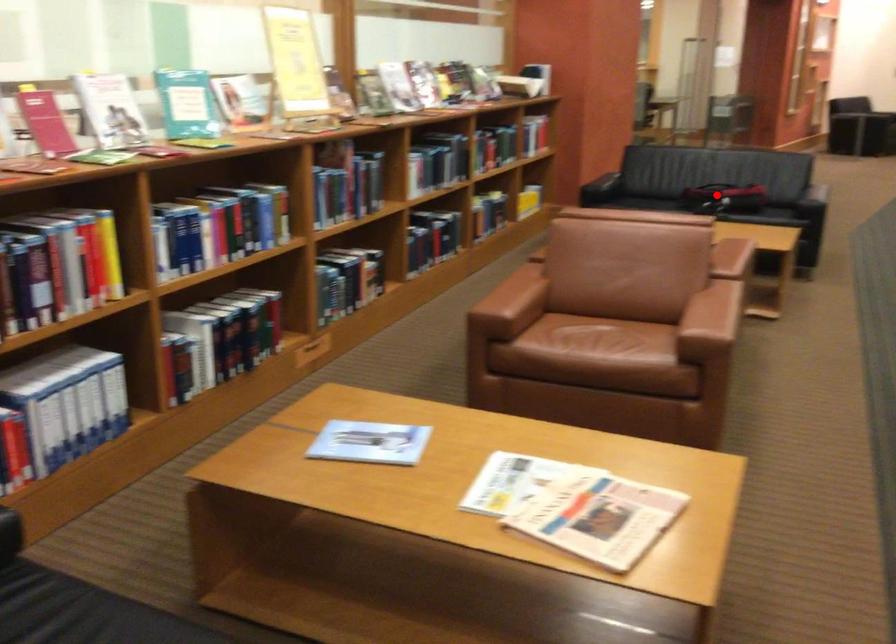
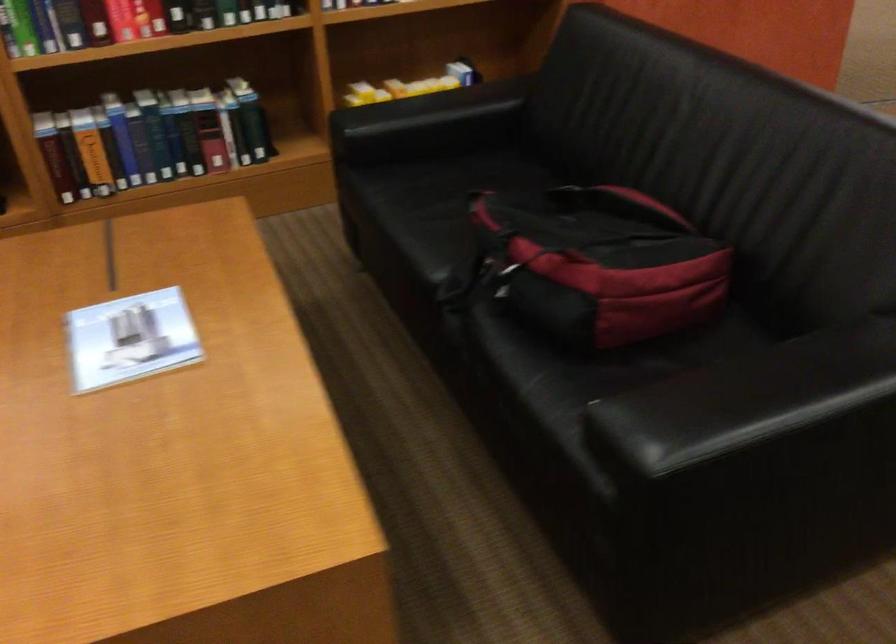
Find the pixel in the second image that matches the highlighted location in the first image.

(495, 277)